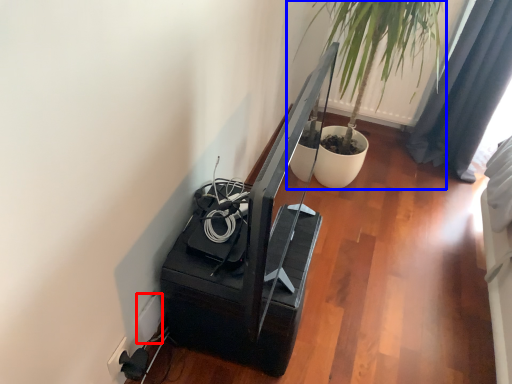
Question: Which object is closer to the camera taking this photo, electric outlet (highlighted by a red box) or houseplant (highlighted by a blue box)?

Choices:
 (A) electric outlet
 (B) houseplant

Answer: (A)